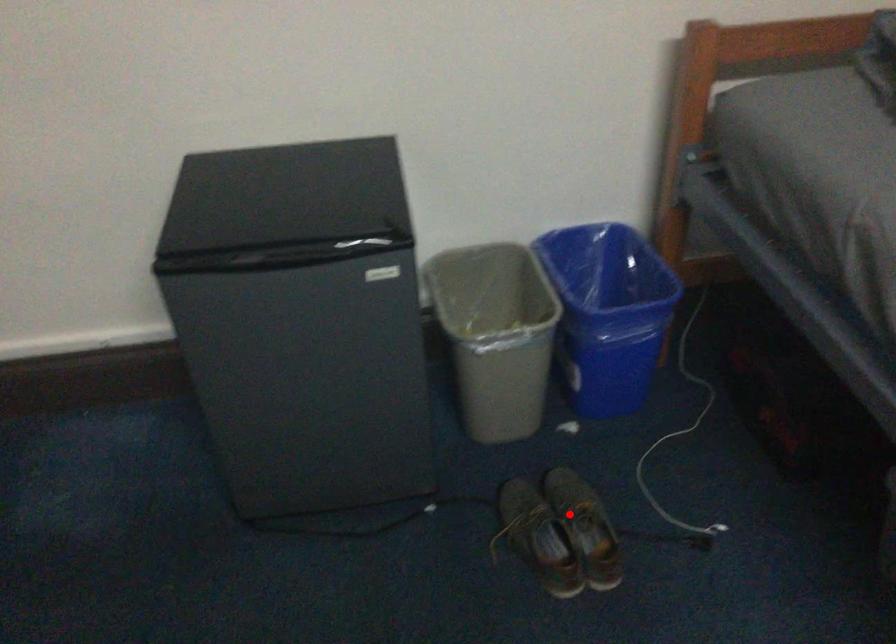
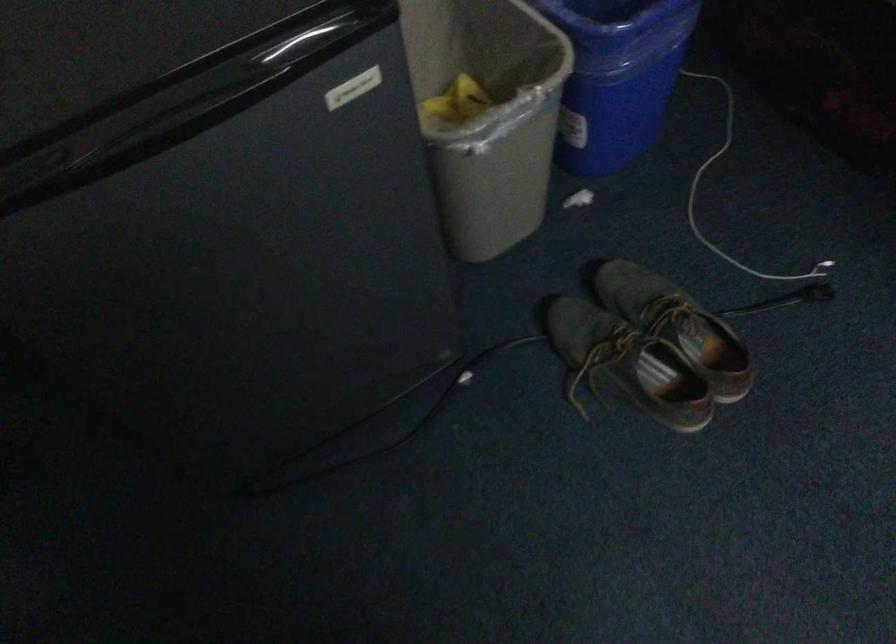
Question: I am providing you with two images of the same scene from different viewpoints. Image1 has a red point marked. In image2, the corresponding 3D location appears at what relative position? Reply with the corresponding letter.

Choices:
 (A) Closer
 (B) Farther

Answer: (A)